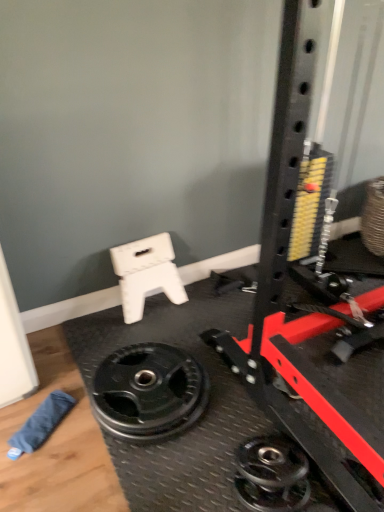
Where is `free area behind black rubber weight plate at lower center`? The width and height of the screenshot is (384, 512). free area behind black rubber weight plate at lower center is located at coordinates (136, 331).